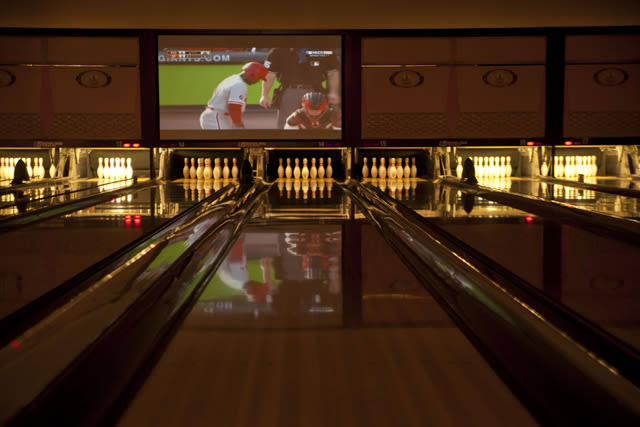
The height and width of the screenshot is (427, 640). I want to click on screens, so click(x=262, y=101), click(x=109, y=101), click(x=417, y=104), click(x=575, y=100).